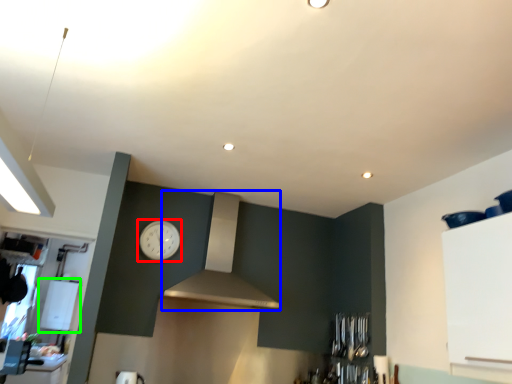
Question: Based on their relative distances, which object is nearer to clock (highlighted by a red box)? Choose from vent (highlighted by a blue box) and appliance (highlighted by a green box).

Choices:
 (A) vent
 (B) appliance

Answer: (A)